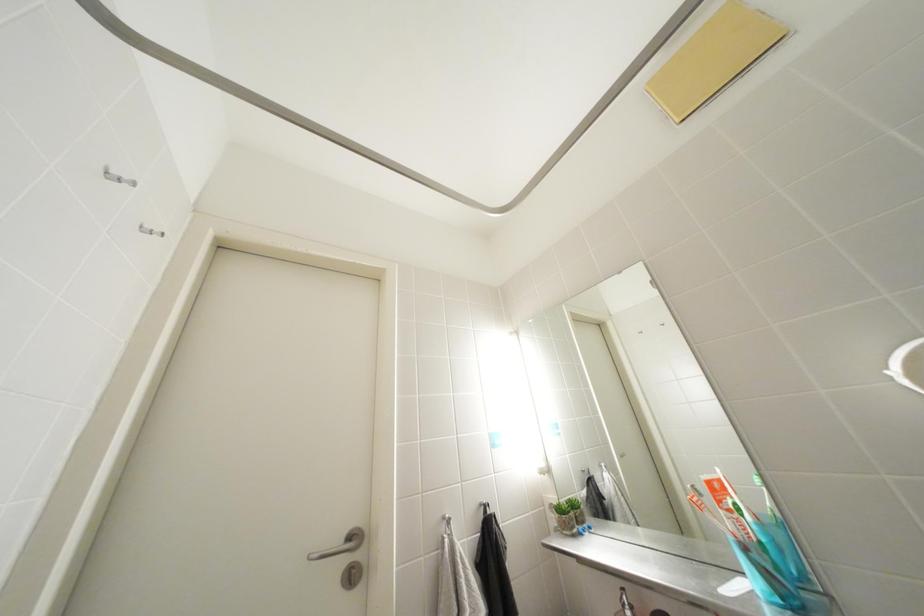
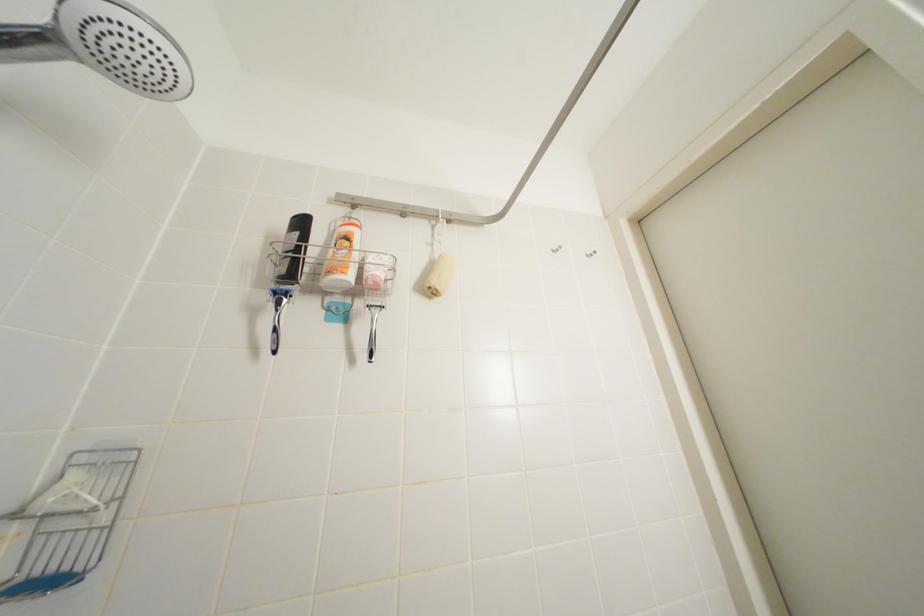
Based on the continuous images, in which direction is the camera rotating?

The rotation direction of the camera is left-up.